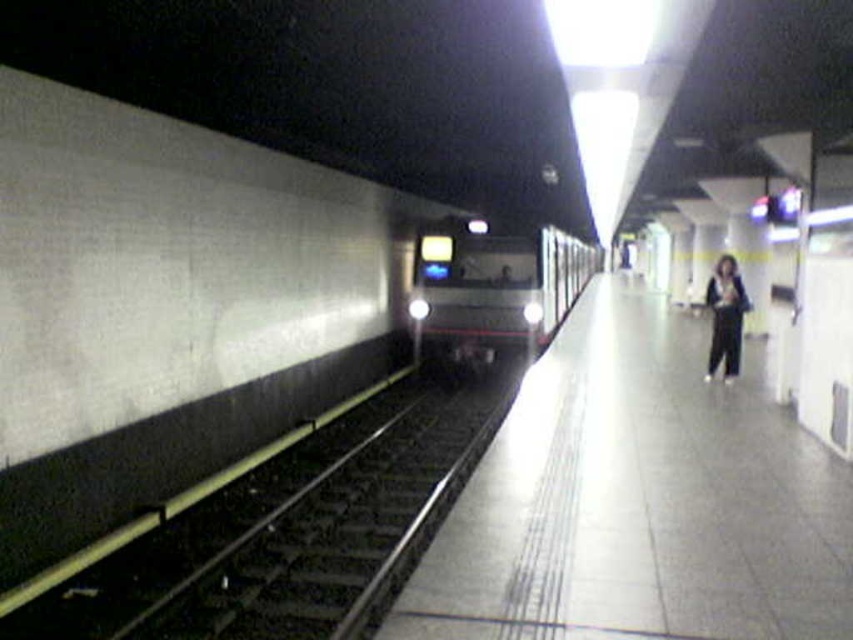
Question: Which object is the closest to the metallic silver train at center?

Choices:
 (A) smooth concrete platform at center
 (B) black metal train track at center
 (C) dark gray pants at right

Answer: (A)

Question: Is black metal train track at center positioned behind dark gray pants at right?

Choices:
 (A) yes
 (B) no

Answer: (B)

Question: Estimate the real-world distances between objects in this image. Which object is closer to the dark gray pants at right?

Choices:
 (A) black metal train track at center
 (B) metallic silver train at center

Answer: (B)

Question: Is smooth concrete platform at center bigger than dark gray pants at right?

Choices:
 (A) no
 (B) yes

Answer: (B)

Question: Which object appears farthest from the camera in this image?

Choices:
 (A) metallic silver train at center
 (B) dark gray pants at right
 (C) black metal train track at center

Answer: (A)

Question: Does metallic silver train at center come in front of dark gray pants at right?

Choices:
 (A) no
 (B) yes

Answer: (A)